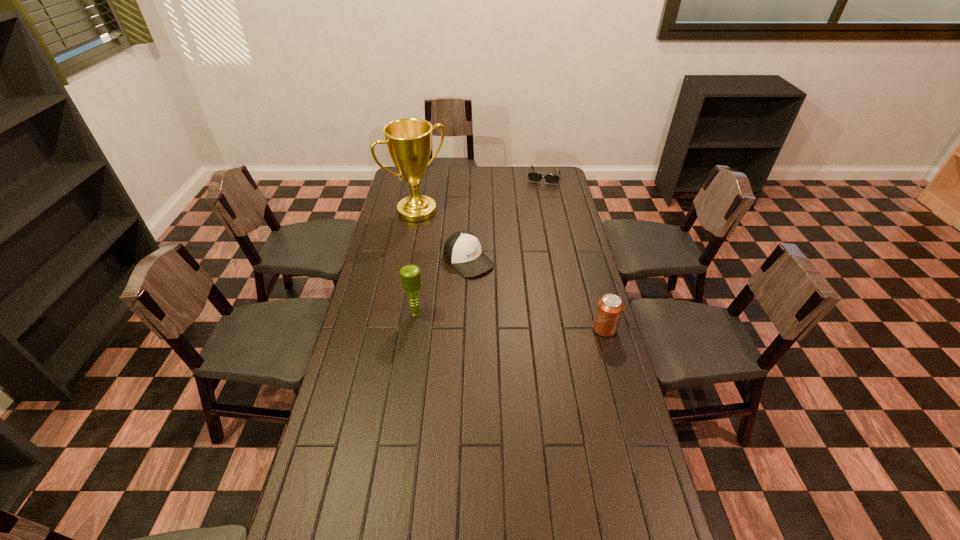
At what (x,y) coordinates should I click in order to perform the action: click on free region that satisfies the following two spatial constraints: 1. on the front side of the cap; 2. on the left side of the third tallest object. Please return your answer as a coordinate pair (x, y). Looking at the image, I should click on (467, 329).

This screenshot has height=540, width=960. Identify the location of vacant space that satisfies the following two spatial constraints: 1. on the back side of the shortest object; 2. on the left side of the cap. (471, 177).

Where is `free location that satisfies the following two spatial constraints: 1. on the back side of the second tallest object; 2. on the left side of the third farthest object`? This screenshot has height=540, width=960. free location that satisfies the following two spatial constraints: 1. on the back side of the second tallest object; 2. on the left side of the third farthest object is located at coordinates (423, 260).